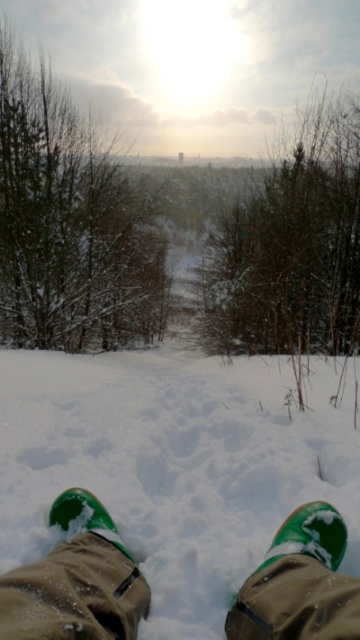
Is point (297, 524) closer to camera compared to point (95, 508)?

Yes, it is in front of point (95, 508).

Is point (308, 502) less distant than point (105, 515)?

No, it is not.

What are the coordinates of `green suede shoe at lower center` in the screenshot? It's located at (311, 536).

How far apart are green suede boots at lower center and green suede boot at lower center?

A distance of 12.50 centimeters exists between green suede boots at lower center and green suede boot at lower center.

Who is lower down, green suede boots at lower center or green suede boot at lower center?

green suede boot at lower center is lower down.

Describe the element at coordinates (75, 580) in the screenshot. I see `green suede boots at lower center` at that location.

At what (x,y) coordinates should I click in order to perform the action: click on green suede boots at lower center. Please return your answer as a coordinate pair (x, y). The width and height of the screenshot is (360, 640). Looking at the image, I should click on (75, 580).

Based on the photo, between green suede boots at lower center and green suede shoe at lower center, which one has less height?

Standing shorter between the two is green suede shoe at lower center.

Which is above, green suede boots at lower center or green suede shoe at lower center?

green suede boots at lower center is higher up.

What do you see at coordinates (75, 580) in the screenshot? I see `green suede boots at lower center` at bounding box center [75, 580].

Identify the location of green suede boots at lower center. Image resolution: width=360 pixels, height=640 pixels. pyautogui.click(x=75, y=580).